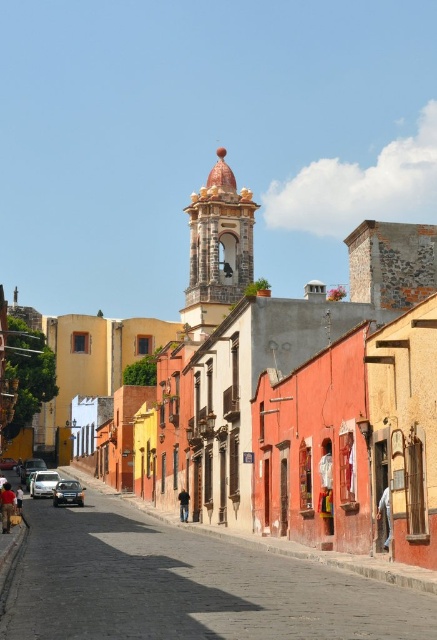
You are standing on the cobblestone street in the historic town and want to walk from the point at coordinates (384, 509) to the point at (6, 460). Based on the scene description, which direction should you face to move towards the second point?

Since point (384, 509) is closer to the viewer than point (6, 460), you should face downward to move towards the second point.

You are standing on the cobblestone street in the historic town. You see the gray fabric pants at lower right and the shiny silver car at center. Which object is farther from you?

The gray fabric pants at lower right is 278.13 feet away from the shiny silver car at center. Since the distance between them is 278.13 feet, the gray fabric pants at lower right is farther from you than the shiny silver car at center.